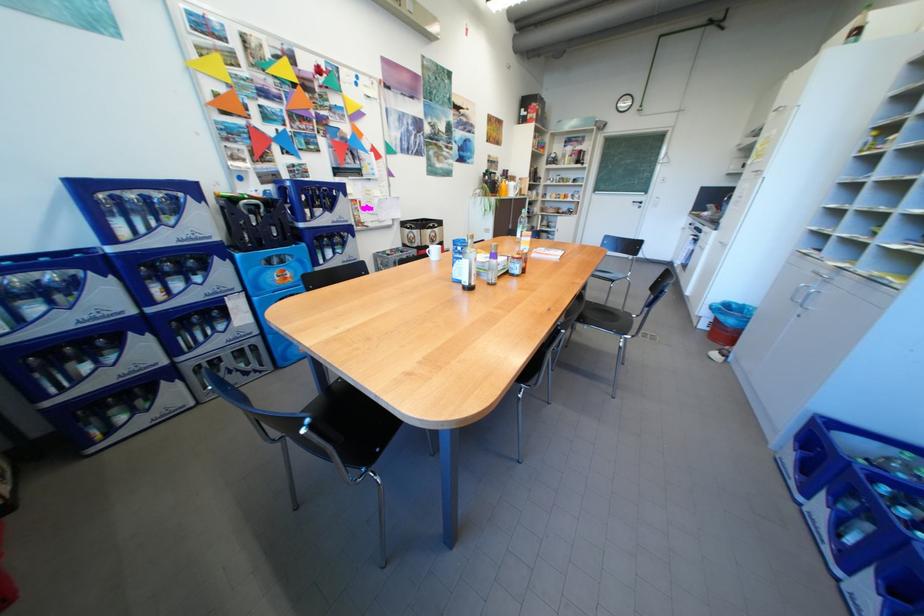
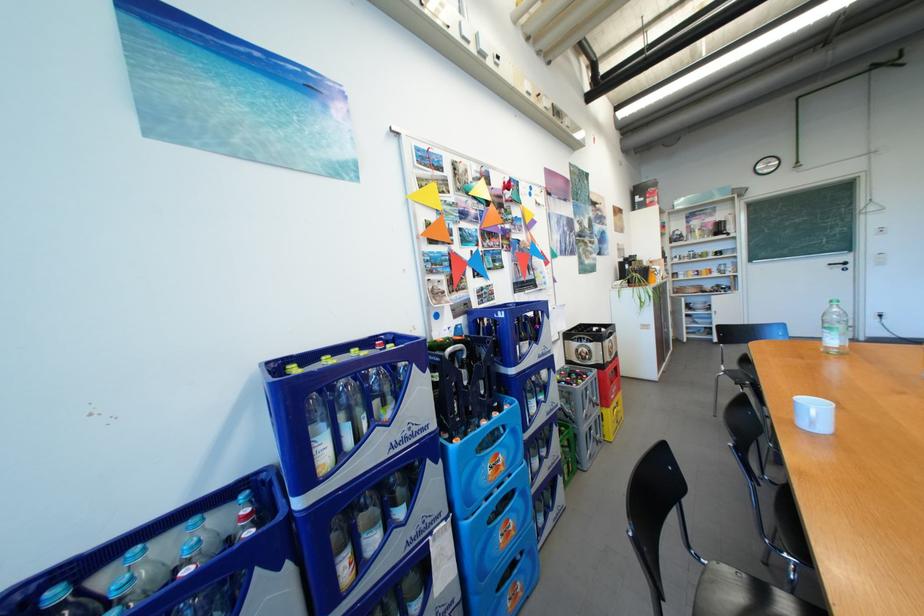
What movement of the cameraman would produce the second image?

The movement direction of the cameraman is left, forward.